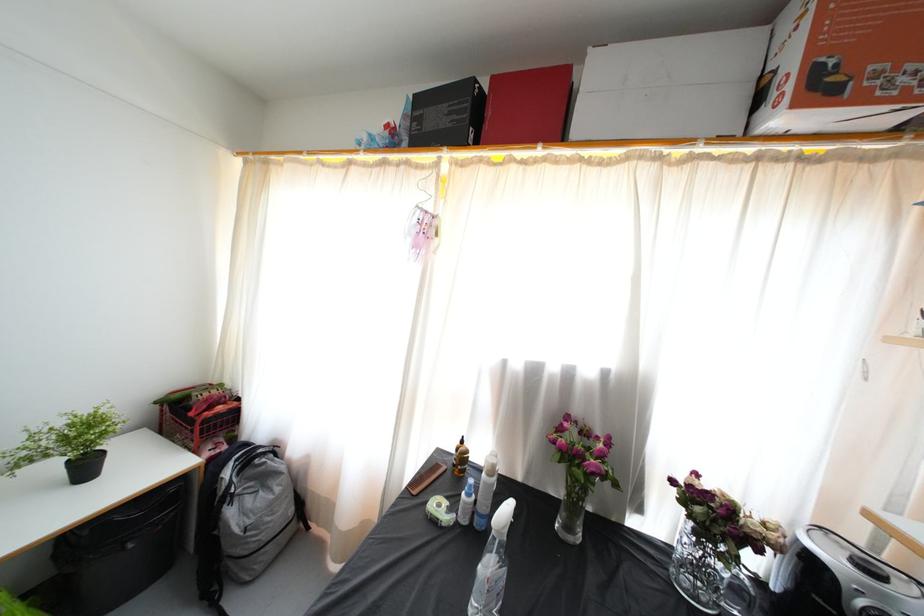
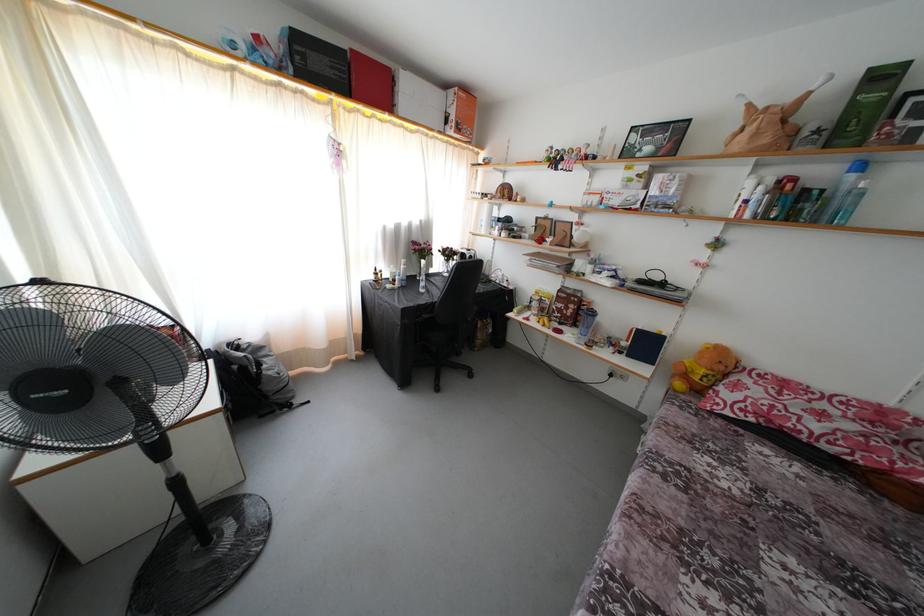
The point at [236,569] is marked in the first image. Where is the corresponding point in the second image?

(281, 403)